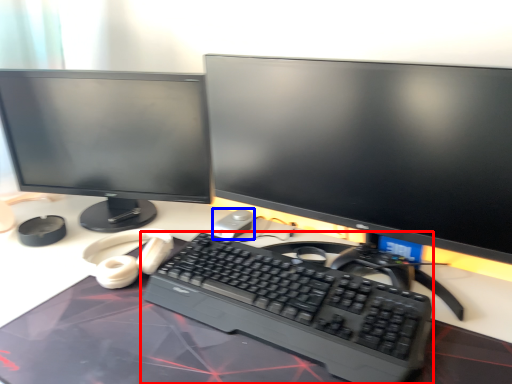
Question: Among these objects, which one is nearest to the camera, computer keyboard (highlighted by a red box) or mouse (highlighted by a blue box)?

Choices:
 (A) computer keyboard
 (B) mouse

Answer: (A)